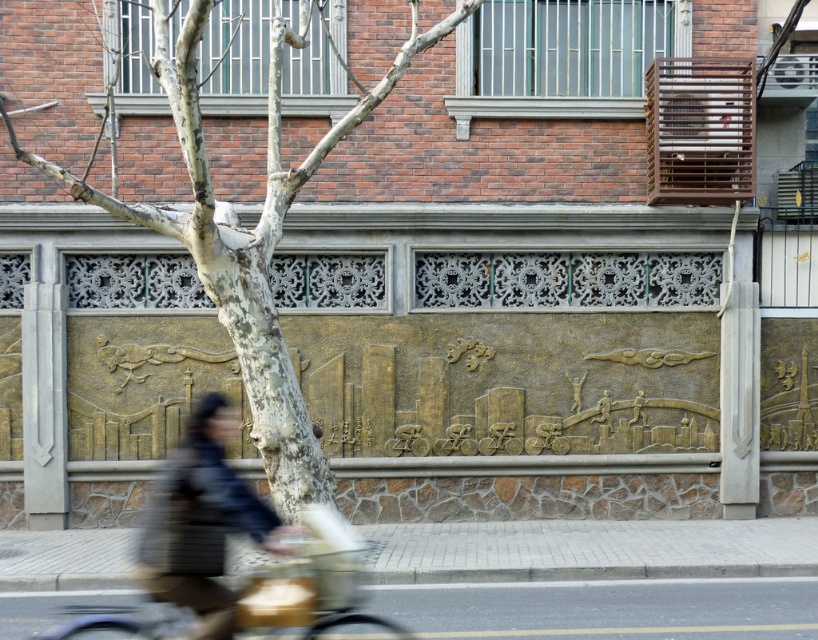
Question: Which object is the closest to the smooth bark tree at center?

Choices:
 (A) gold metallic bicycle at lower left
 (B) matte black jacket at lower left

Answer: (B)

Question: Can you confirm if smooth bark tree at center is wider than gold metallic bicycle at lower left?

Choices:
 (A) no
 (B) yes

Answer: (B)

Question: Which of the following is the closest to the observer?

Choices:
 (A) (279, 433)
 (B) (190, 568)

Answer: (B)

Question: From the image, what is the correct spatial relationship of matte black jacket at lower left in relation to gold metallic bicycle at lower left?

Choices:
 (A) right
 (B) left

Answer: (B)

Question: Which is farther from the smooth bark tree at center?

Choices:
 (A) gold metallic bicycle at lower left
 (B) matte black jacket at lower left

Answer: (A)

Question: Does matte black jacket at lower left come behind gold metallic bicycle at lower left?

Choices:
 (A) no
 (B) yes

Answer: (B)